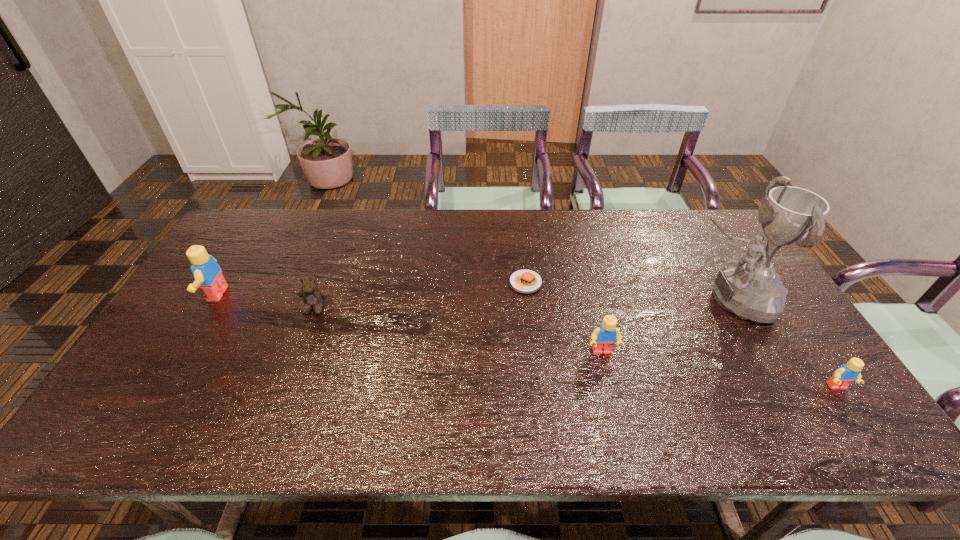
At what (x,y) coordinates should I click in order to perform the action: click on vacant region located 0.060m on the front-facing side of the second nearest object. Please return your answer as a coordinate pair (x, y). Looking at the image, I should click on (609, 379).

The height and width of the screenshot is (540, 960). Identify the location of vacant space located 0.080m on the front of the food. (529, 315).

Identify the location of vacant area located 0.110m on the side with emblem of the tallest object. (651, 299).

Image resolution: width=960 pixels, height=540 pixels. In order to click on free space located on the side with emblem of the tallest object in this screenshot , I will do `click(565, 299)`.

Identify the location of vacant position located 0.090m on the side with emblem of the tallest object. (658, 299).

Find the location of `vacant space situated 0.100m on the face of the teddy bear`. vacant space situated 0.100m on the face of the teddy bear is located at coordinates (301, 345).

Where is `object that is at the near edge`? This screenshot has width=960, height=540. object that is at the near edge is located at coordinates (844, 375).

Locate an element on the screen. This screenshot has width=960, height=540. object that is at the left edge is located at coordinates (208, 275).

You are a GUI agent. You are given a task and a screenshot of the screen. Output one action in this format:
    pyautogui.click(x=<x>, y=<y>)
    Task: Click on the Lego that is at the right edge
    
    Given the screenshot: What is the action you would take?
    pyautogui.click(x=844, y=375)

At what (x,y) coordinates should I click in order to perform the action: click on award that is at the right edge. Please return your answer as a coordinate pair (x, y). The height and width of the screenshot is (540, 960). Looking at the image, I should click on (750, 288).